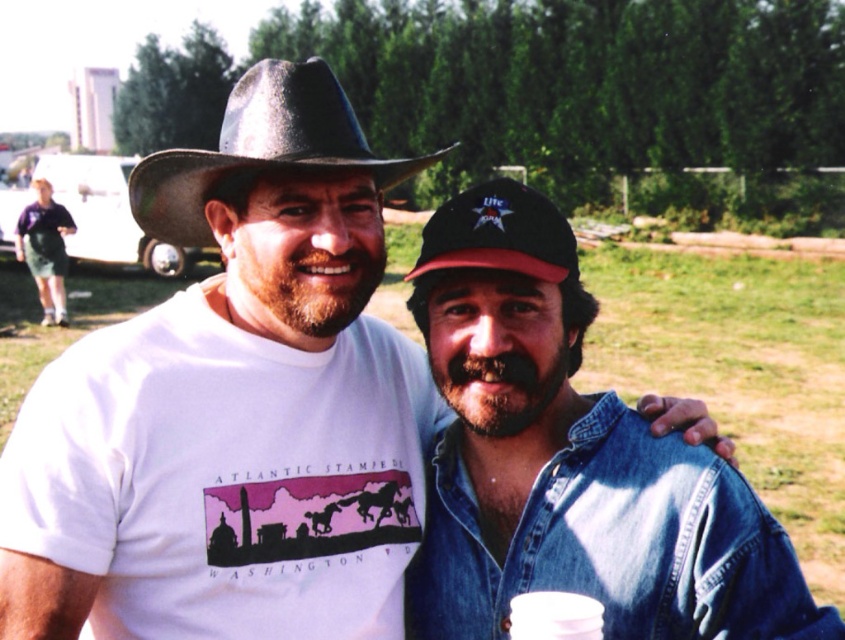
Is point (526, 252) positioned before point (533, 593)?

No, it is not.

Is denim jacket at center smaller than white plastic cup at lower center?

No.

Find the location of a particular element. This screenshot has height=640, width=845. denim jacket at center is located at coordinates (570, 460).

Between dark gray felt cowboy hat at upper left and white plastic cup at lower center, which one has less height?

white plastic cup at lower center

Is dark gray felt cowboy hat at upper left further to the viewer compared to white plastic cup at lower center?

Yes, dark gray felt cowboy hat at upper left is behind white plastic cup at lower center.

Which is behind, point (289, 129) or point (597, 636)?

The point (289, 129) is more distant.

The height and width of the screenshot is (640, 845). I want to click on dark gray felt cowboy hat at upper left, so click(260, 147).

Is denim jacket at center further to camera compared to dark gray felt cowboy hat at upper left?

No, denim jacket at center is closer to the viewer.

Is denim jacket at center shorter than dark gray felt cowboy hat at upper left?

Yes.

The width and height of the screenshot is (845, 640). What do you see at coordinates (570, 460) in the screenshot?
I see `denim jacket at center` at bounding box center [570, 460].

Locate an element on the screen. The image size is (845, 640). denim jacket at center is located at coordinates (570, 460).